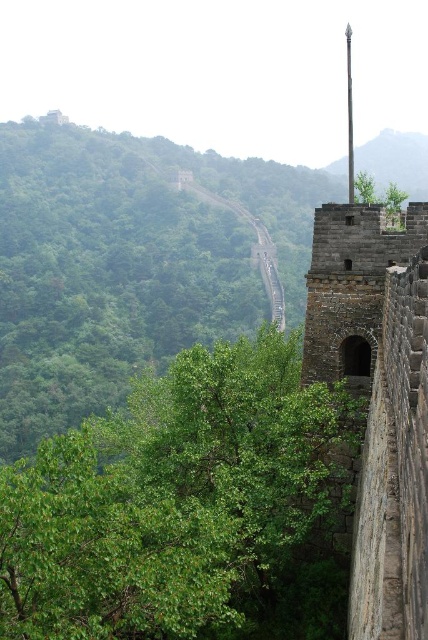
You are standing on the Great Wall of China and notice two points marked on the wall. One is at coordinates point (145, 529) and the other at point (391, 180). Which point is nearer to you?

Point (145, 529) is closer to the viewer than point (391, 180).

You are a hiker standing at the base of the Great Wall. You notice the green stone wall at upper center and the green leafy tree at upper center. Which one is higher in this part of the scene?

The green stone wall at upper center is taller than the green leafy tree at upper center.